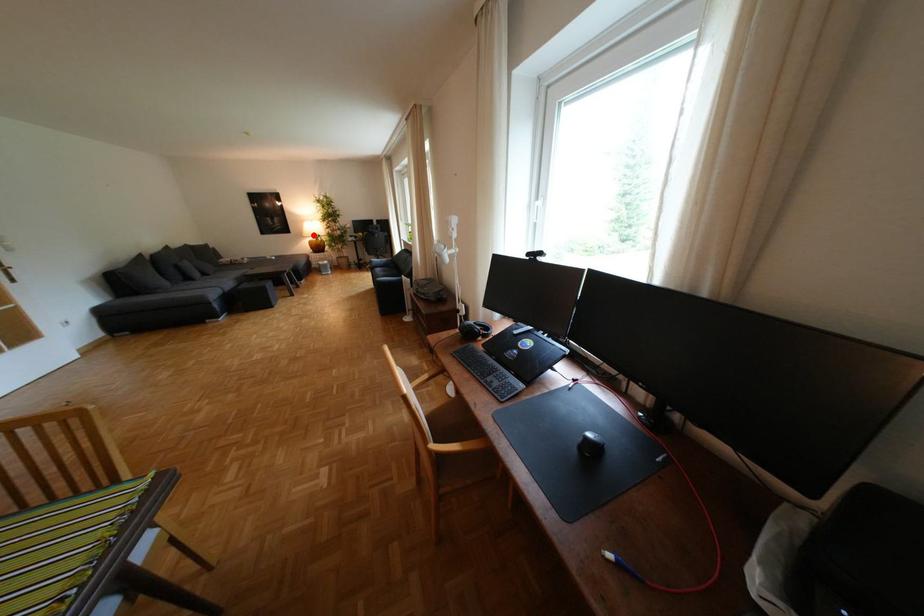
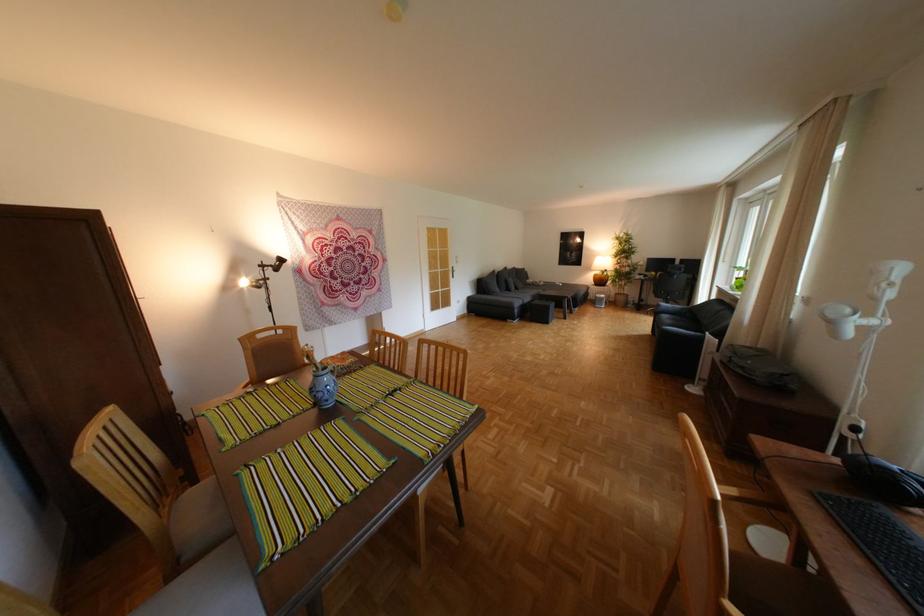
Find the pixel in the second image that matches the highlighted location in the first image.

(602, 268)